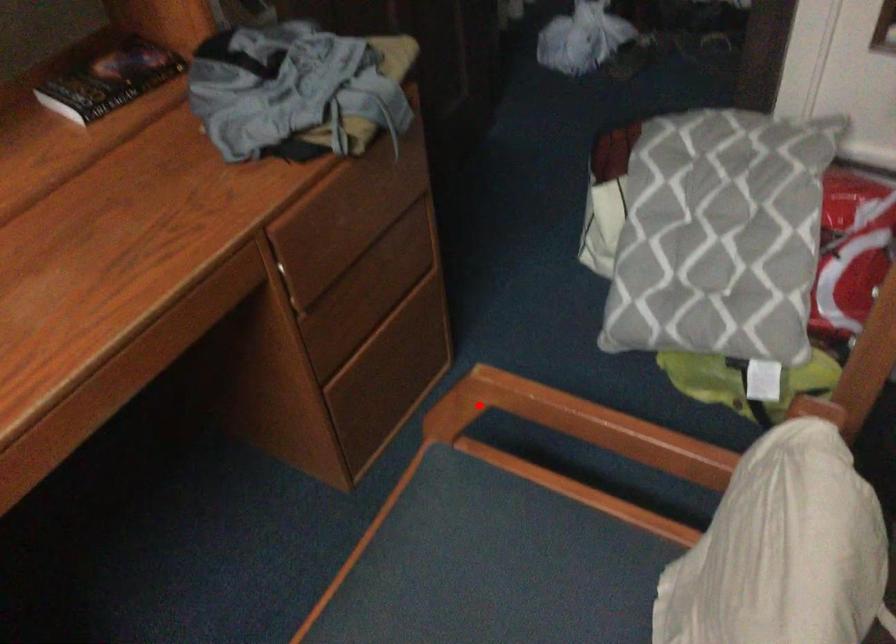
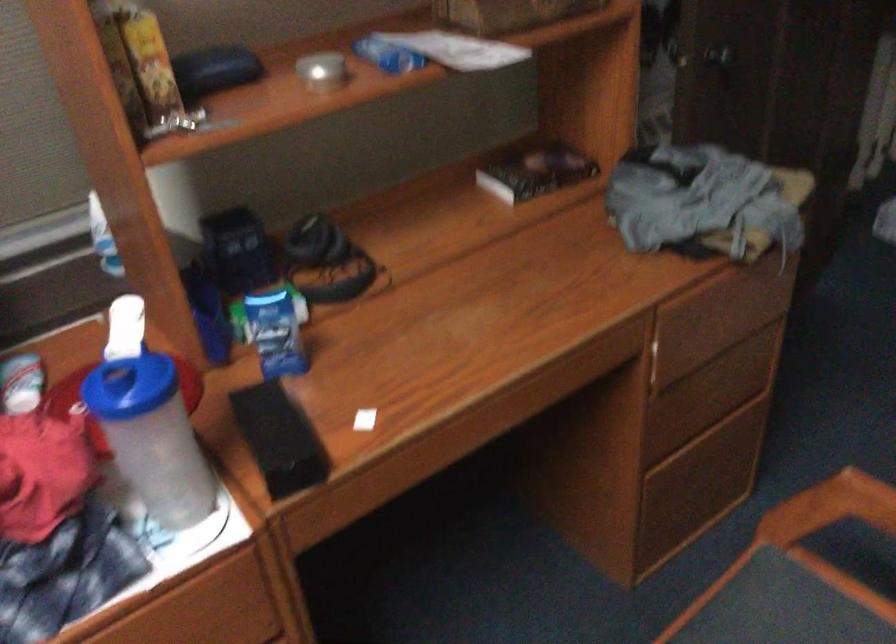
Where in the second image is the point corresponding to the highlighted location from the first image?

(830, 507)